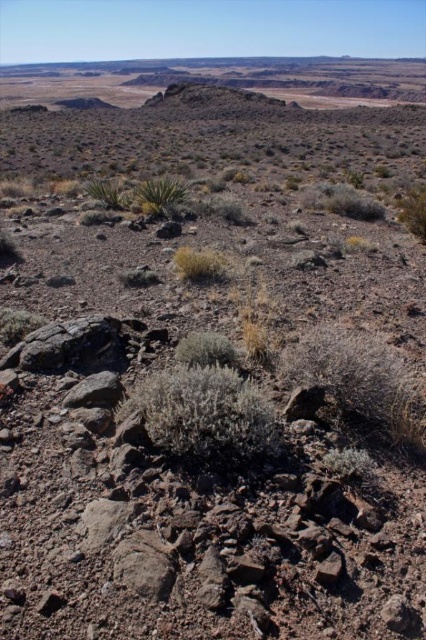
Question: In this image, where is green fuzzy bush at right located relative to green leafy plant at center-left?

Choices:
 (A) right
 (B) left

Answer: (A)

Question: Which object appears closest to the camera in this image?

Choices:
 (A) gray fuzzy bush at center
 (B) green leafy plant at center-left
 (C) dry grass at center
 (D) green fuzzy bush at right

Answer: (A)

Question: Which of the following is the closest to the observer?

Choices:
 (A) green fuzzy bush at right
 (B) green fuzzy bush at center
 (C) green leafy plant at center

Answer: (B)

Question: Which of the following is the farthest from the observer?

Choices:
 (A) click(207, 268)
 (B) click(411, 192)
 (C) click(198, 346)

Answer: (B)

Question: Does dry grass at center have a lesser width compared to green leafy plant at center-left?

Choices:
 (A) yes
 (B) no

Answer: (A)

Question: Does gray fuzzy bush at center come in front of dry grass at center?

Choices:
 (A) yes
 (B) no

Answer: (A)